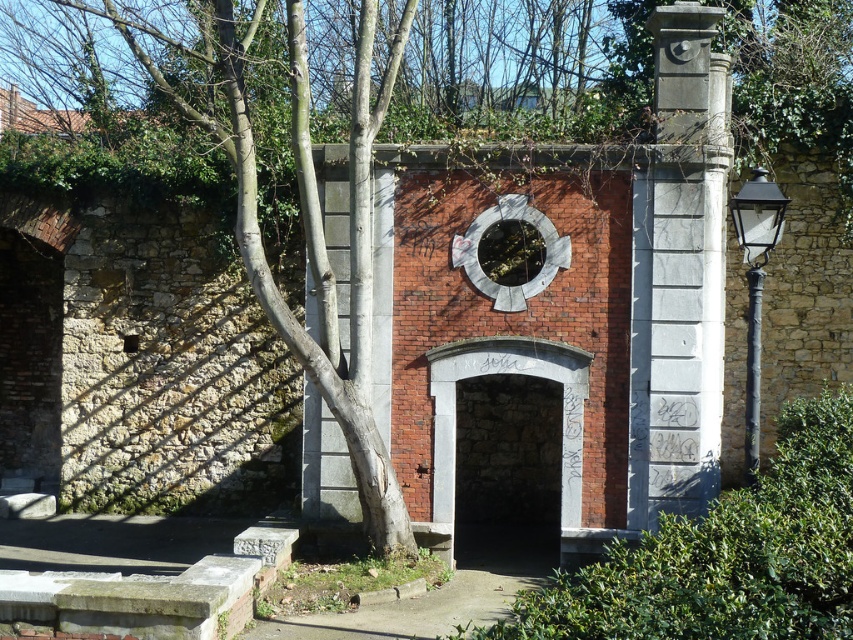
You are standing in front of the old brick wall and want to touch both the gray marble column at right and the stone archway at center. Which one can you reach first without moving your position?

The gray marble column at right is closer to the viewer than the stone archway at center, so you can reach it first without moving.

You are standing in front of the brick wall and want to take a photo of the stone archway at center without the green leafy ivy at center blocking it. What should you do?

Move to the side so the green leafy ivy at center is no longer in front of the stone archway at center, allowing you to capture the archway without obstruction.